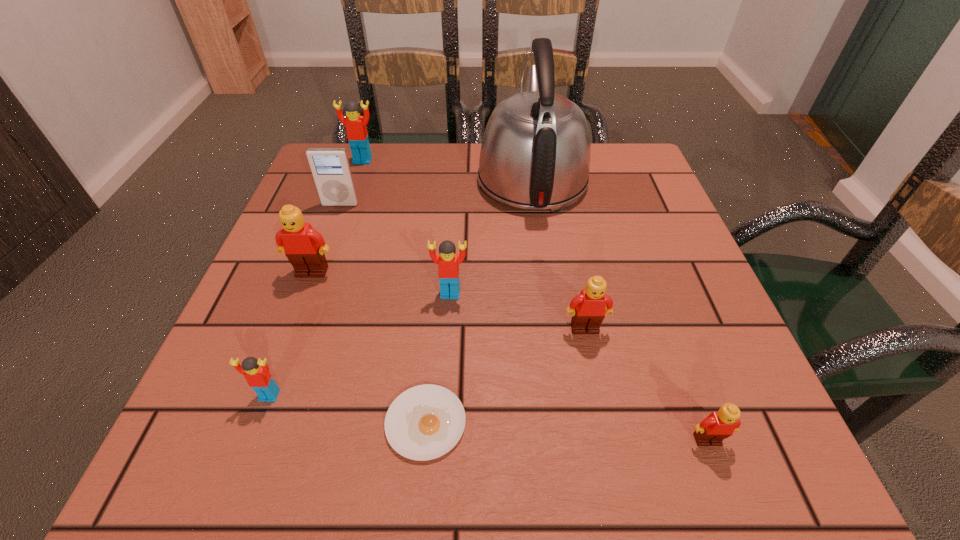
Identify the location of vacant position located on the face of the third Lego from right to left. The image size is (960, 540). (445, 368).

You are a GUI agent. You are given a task and a screenshot of the screen. Output one action in this format:
    pyautogui.click(x=<x>, y=<y>)
    Task: Click on the vacant region located on the face of the second nearest brown Lego
    
    Given the screenshot: What is the action you would take?
    pyautogui.click(x=591, y=362)

Locate an element on the screen. The height and width of the screenshot is (540, 960). free location located on the face of the second nearest Lego is located at coordinates (238, 481).

Where is `free space located 0.290m on the right of the egg yolk`? free space located 0.290m on the right of the egg yolk is located at coordinates (673, 422).

Identify the location of kettle that is at the far edge. (535, 154).

I want to click on Lego present at the far edge, so click(357, 135).

Locate an element on the screen. This screenshot has height=540, width=960. Lego located in the near edge section of the desktop is located at coordinates [719, 425].

I want to click on egg yolk present at the near edge, so click(x=424, y=422).

Where is `iPod located in the left edge section of the desktop`? Image resolution: width=960 pixels, height=540 pixels. iPod located in the left edge section of the desktop is located at coordinates (330, 167).

This screenshot has height=540, width=960. In order to click on kettle that is positioned at the right edge in this screenshot , I will do `click(535, 154)`.